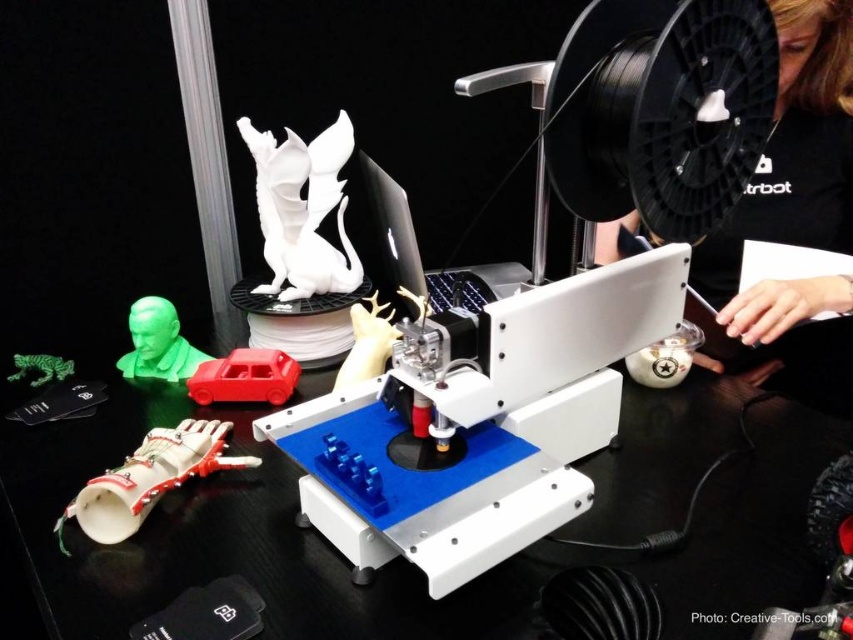
In order to click on white matte prosthetic hand at lower left in this screenshot , I will do `click(148, 477)`.

Which of these two, white matte prosthetic hand at lower left or matte red car at center, stands shorter?

matte red car at center

Where is `white matte prosthetic hand at lower left`? Image resolution: width=853 pixels, height=640 pixels. white matte prosthetic hand at lower left is located at coordinates (148, 477).

Does black matte spool at upper center come behind white glossy dragon at center?

No, black matte spool at upper center is in front of white glossy dragon at center.

Does black matte spool at upper center have a lesser width compared to white glossy dragon at center?

No.

Between point (836, 292) and point (314, 172), which one is positioned behind?

The point (314, 172) is more distant.

Where is `black matte spool at upper center`? The image size is (853, 640). black matte spool at upper center is located at coordinates (796, 212).

Is point (225, 500) in front of point (91, 531)?

No, (225, 500) is behind (91, 531).

Which is more to the left, black glossy table at center or white matte prosthetic hand at lower left?

Positioned to the left is white matte prosthetic hand at lower left.

Between point (219, 563) and point (102, 493), which one is positioned behind?

Point (102, 493)

Where is `black glossy table at center`? black glossy table at center is located at coordinates (393, 563).